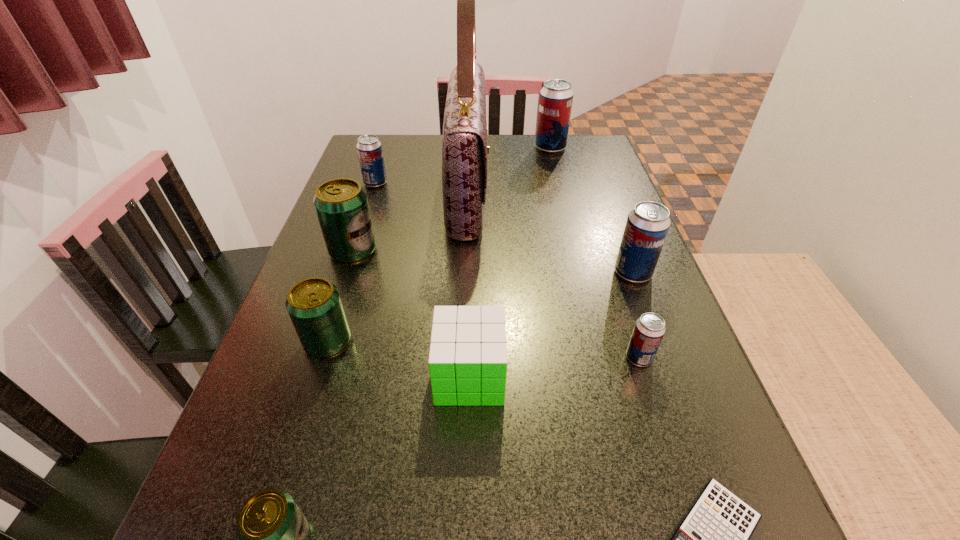
The image size is (960, 540). In order to click on beer can at the far edge in this screenshot , I will do `click(556, 97)`.

At what (x,y) coordinates should I click in order to perform the action: click on object that is at the far right corner. Please return your answer as a coordinate pair (x, y). Looking at the image, I should click on (556, 97).

Find the location of `free space at the far edge of the desktop`. free space at the far edge of the desktop is located at coordinates (489, 156).

This screenshot has height=540, width=960. What are the coordinates of `free point at the left edge` in the screenshot? It's located at (234, 518).

Find the location of `free space at the right edge of the desktop`. free space at the right edge of the desktop is located at coordinates (611, 267).

Where is `free location at the far left corner`? The image size is (960, 540). free location at the far left corner is located at coordinates (380, 141).

Identify the location of blank space at the far right corner. (608, 158).

Identify the location of vacant area that lies between the third farthest red beer can and the biggest green beer can. The height and width of the screenshot is (540, 960). (493, 262).

The image size is (960, 540). Identify the location of unoccupied area between the handbag and the cube. (469, 284).

Find the location of a particular element. The width and height of the screenshot is (960, 540). vacant space that is in between the nearest red beer can and the cube is located at coordinates (554, 367).